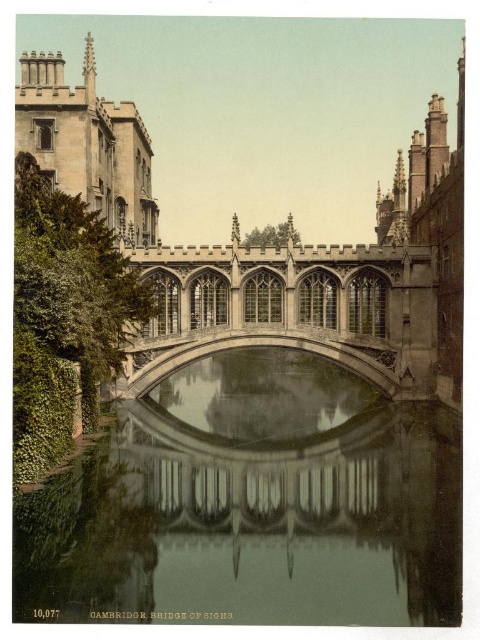
Looking at this image, you are standing on the Bridge of Sighs in Cambridge, England, and you notice two points marked on the bridge. The first point is at coordinate point (186, 496) and the second is at point (311, 308). Which point is closer to you as you stand on the bridge?

Point (186, 496) is closer to the viewer than point (311, 308).

You are an architect analyzing the Bridge of Sighs in Cambridge. You observe the clear glass water at center and the stone gothic arch bridge at center. Which object occupies a larger area in the image?

The clear glass water at center is bigger than the stone gothic arch bridge at center, so the clear glass water at center occupies a larger area in the image.